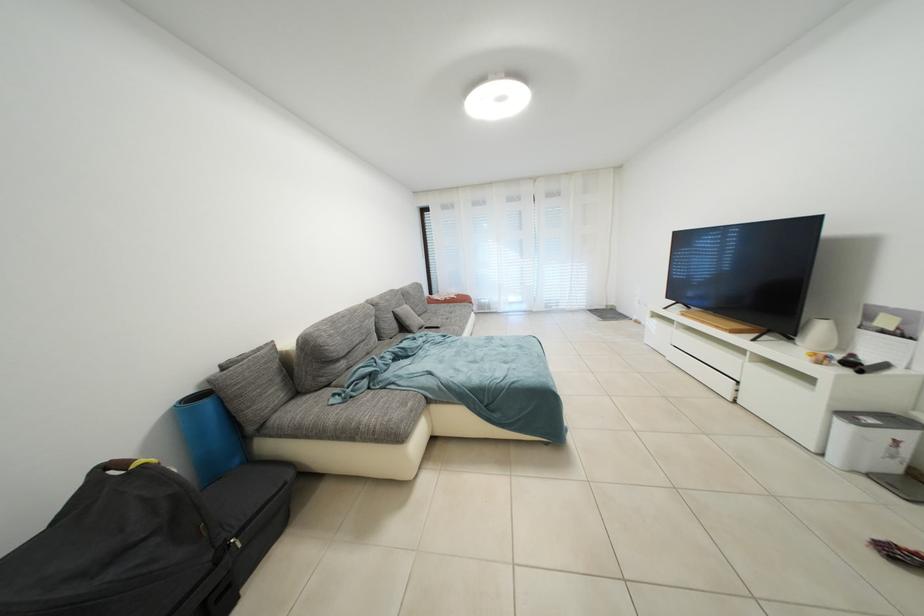
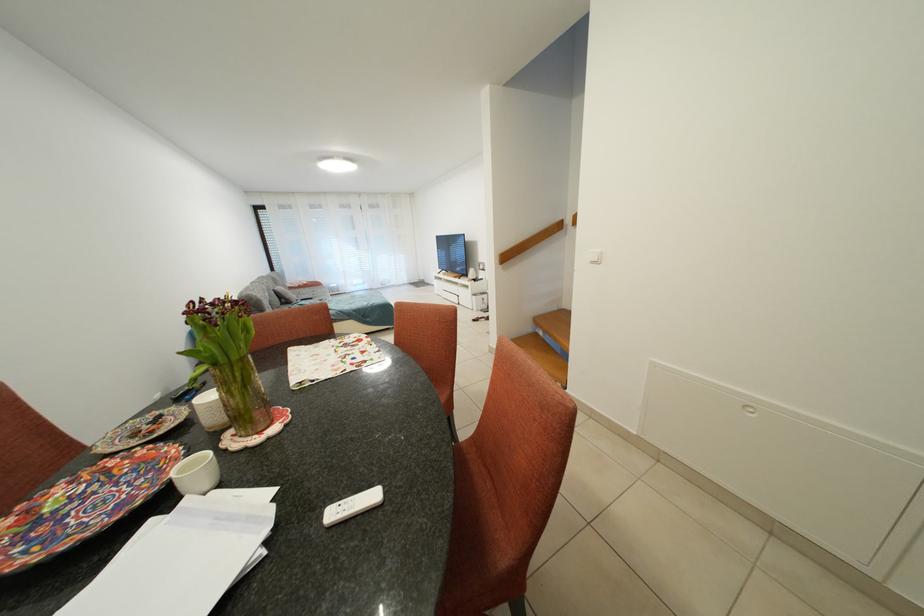
The point at (532, 310) is marked in the first image. Where is the corresponding point in the second image?

(373, 291)